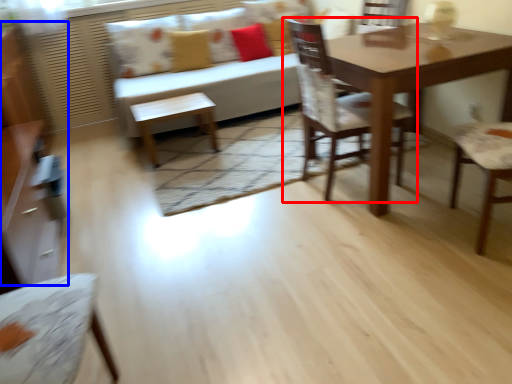
Question: Which point is closer to the camera, chair (highlighted by a red box) or dresser (highlighted by a blue box)?

Choices:
 (A) chair
 (B) dresser

Answer: (A)